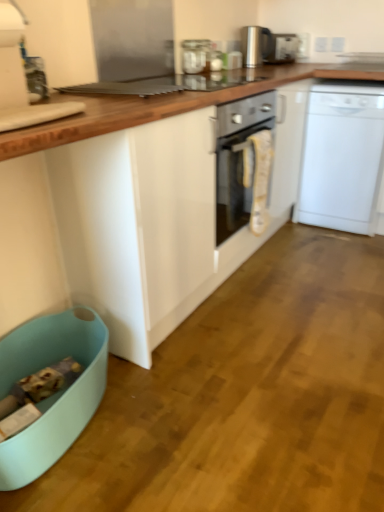
Question: From the image's perspective, would you say white plastic dishwasher at right is positioned over light blue plastic dish washer at lower left?

Choices:
 (A) yes
 (B) no

Answer: (A)

Question: Could you tell me if white plastic dishwasher at right is facing light blue plastic dish washer at lower left?

Choices:
 (A) no
 (B) yes

Answer: (B)

Question: Does white plastic dishwasher at right have a smaller size compared to light blue plastic dish washer at lower left?

Choices:
 (A) yes
 (B) no

Answer: (B)

Question: Can you confirm if white plastic dishwasher at right is positioned to the left of light blue plastic dish washer at lower left?

Choices:
 (A) yes
 (B) no

Answer: (B)

Question: Is white plastic dishwasher at right bigger than light blue plastic dish washer at lower left?

Choices:
 (A) no
 (B) yes

Answer: (B)

Question: From a real-world perspective, is white plastic dishwasher at right physically below light blue plastic dish washer at lower left?

Choices:
 (A) yes
 (B) no

Answer: (B)

Question: From a real-world perspective, is satin silver toaster at upper center on top of light blue plastic dish washer at lower left?

Choices:
 (A) no
 (B) yes

Answer: (B)

Question: Is satin silver toaster at upper center beside light blue plastic dish washer at lower left?

Choices:
 (A) no
 (B) yes

Answer: (A)

Question: From the image's perspective, would you say satin silver toaster at upper center is positioned over light blue plastic dish washer at lower left?

Choices:
 (A) no
 (B) yes

Answer: (B)

Question: Would you consider satin silver toaster at upper center to be distant from light blue plastic dish washer at lower left?

Choices:
 (A) yes
 (B) no

Answer: (A)

Question: Does satin silver toaster at upper center appear on the right side of light blue plastic dish washer at lower left?

Choices:
 (A) yes
 (B) no

Answer: (A)

Question: Can you confirm if satin silver toaster at upper center is wider than light blue plastic dish washer at lower left?

Choices:
 (A) yes
 (B) no

Answer: (B)

Question: Is white plastic dishwasher at right turned away from polished stainless steel kettle at upper center, acting as the first kitchen appliance starting from the back?

Choices:
 (A) no
 (B) yes

Answer: (A)